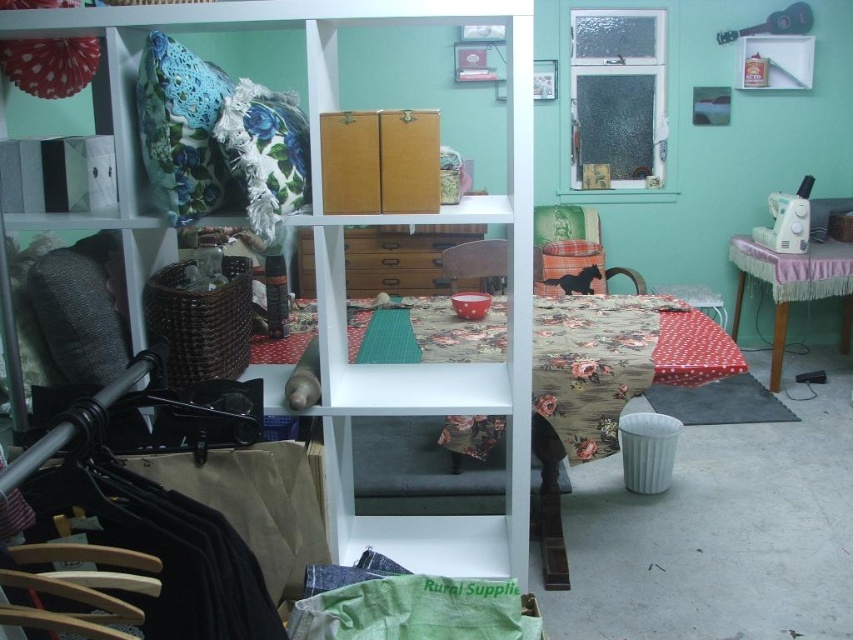
You are organizing the space in the image and need to move the velvet green chair at center. Since the wooden shelf at center is in the way, can you lift the chair over the shelf?

The wooden shelf at center is positioned under the velvet green chair at center, so yes, you can lift the chair over the shelf because the shelf is below it.